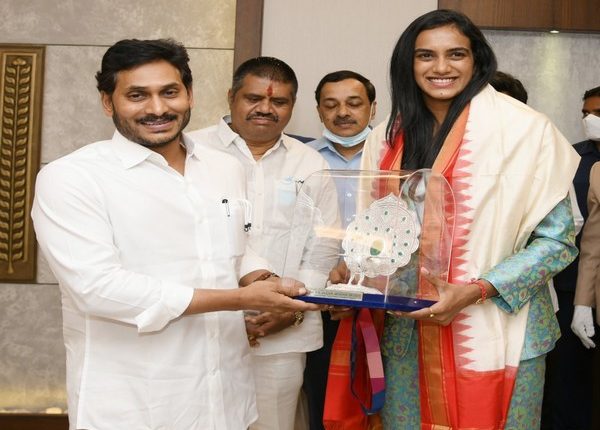
The width and height of the screenshot is (600, 430). I want to click on wall, so click(149, 13), click(328, 33), click(554, 65).